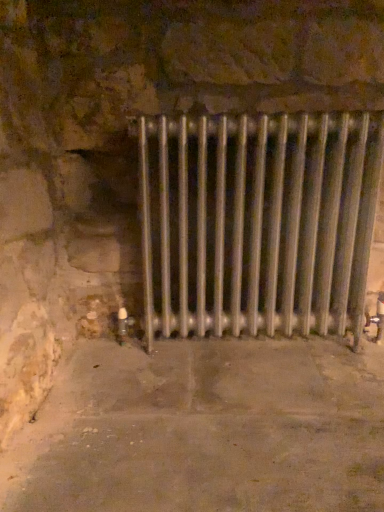
In order to face metallic radiator at center, should I rotate leftwards or rightwards?

You should look right and rotate roughly 8.551 degrees.

The height and width of the screenshot is (512, 384). Identify the location of metallic radiator at center. (x=257, y=222).

The image size is (384, 512). What do you see at coordinates (257, 222) in the screenshot? I see `metallic radiator at center` at bounding box center [257, 222].

What is the approximate width of metallic radiator at center?

metallic radiator at center is 17.44 centimeters wide.

Find the location of a particular element. The height and width of the screenshot is (512, 384). metallic radiator at center is located at coordinates (257, 222).